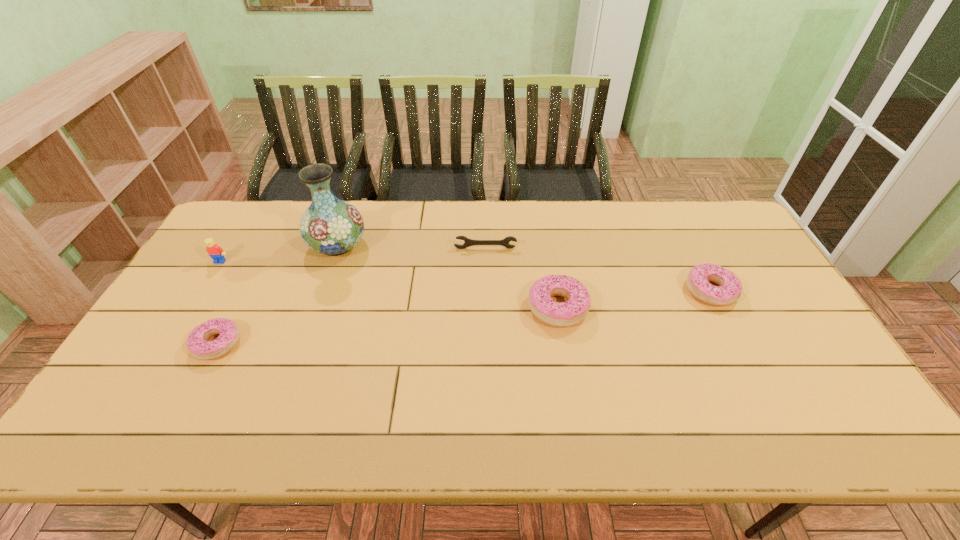
Locate an element on the screen. The height and width of the screenshot is (540, 960). doughnut that is the second closest to the leftmost object is located at coordinates tap(560, 314).

Where is `doughnut that is the closest to the second doughnut from left to right`? This screenshot has width=960, height=540. doughnut that is the closest to the second doughnut from left to right is located at coordinates (730, 287).

I want to click on free space that satisfies the following two spatial constraints: 1. on the face of the Lego; 2. on the right side of the fifth object from right to left, so click(170, 343).

Locate an element on the screen. vacant area in the image that satisfies the following two spatial constraints: 1. on the face of the Lego; 2. on the left side of the shortest doughnut is located at coordinates (170, 343).

You are a GUI agent. You are given a task and a screenshot of the screen. Output one action in this format:
    pyautogui.click(x=<x>, y=<y>)
    Task: Click on the vacant region that satisfies the following two spatial constraints: 1. on the front side of the second object from right to left; 2. on the left side of the tallest object
    Image resolution: width=960 pixels, height=540 pixels.
    Given the screenshot: What is the action you would take?
    pyautogui.click(x=316, y=307)